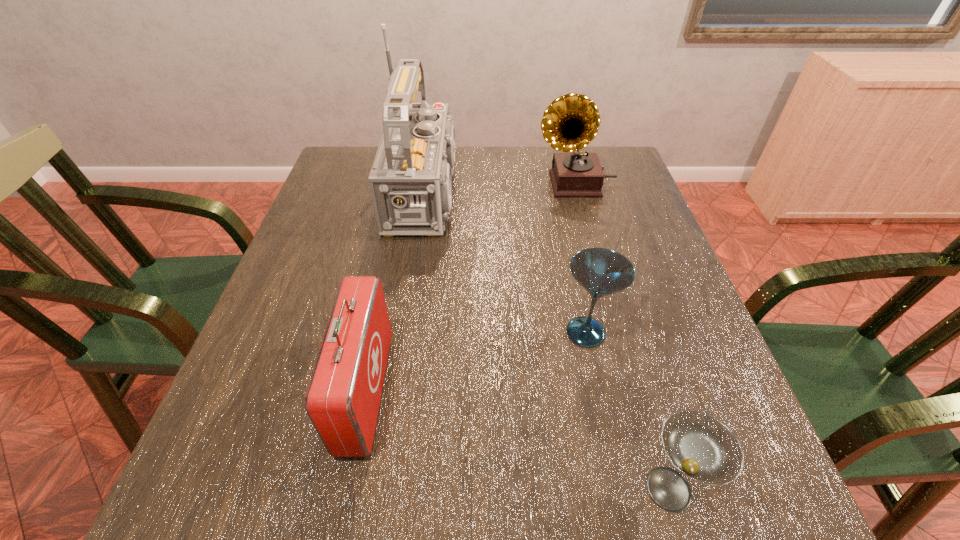
Find the location of a particular element. This screenshot has height=540, width=960. vacant space at the near edge of the desktop is located at coordinates (370, 496).

Where is `vacant space at the left edge`? The height and width of the screenshot is (540, 960). vacant space at the left edge is located at coordinates (345, 241).

Locate an element on the screen. free space at the right edge of the desktop is located at coordinates (636, 227).

Identify the location of vacant space at the far right corner. (614, 167).

Where is `vacant space in between the tallest object and the nearer martini`? vacant space in between the tallest object and the nearer martini is located at coordinates [x=551, y=341].

Locate an element on the screen. The image size is (960, 540). free point between the fourth shortest object and the tallest object is located at coordinates (504, 188).

At what (x,y) coordinates should I click in order to perform the action: click on free point between the radio receiver and the farther martini. Please return your answer as a coordinate pair (x, y). The width and height of the screenshot is (960, 540). Looking at the image, I should click on (510, 263).

This screenshot has height=540, width=960. What are the coordinates of `free space between the nearer martini and the phonograph record` in the screenshot? It's located at (622, 336).

Find the location of `vacant space that is in between the third shortest object and the nearer martini`. vacant space that is in between the third shortest object and the nearer martini is located at coordinates (517, 440).

This screenshot has width=960, height=540. Identify the location of free space between the radio receiver and the second tallest object. (504, 188).